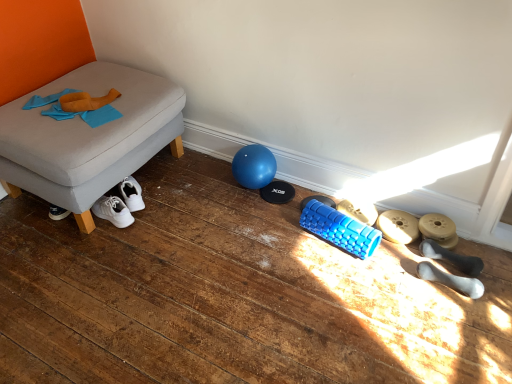
Question: From the image's perspective, does white rubber dumbbell at lower right, which ranks as the first footwear in front-to-back order, appear higher than gray fabric ottoman at left?

Choices:
 (A) no
 (B) yes

Answer: (A)

Question: Is white rubber dumbbell at lower right, placed as the 5th footwear when sorted from back to front, in contact with gray fabric ottoman at left?

Choices:
 (A) yes
 (B) no

Answer: (B)

Question: From the image's perspective, is white rubber dumbbell at lower right, placed as the 5th footwear when sorted from back to front, located beneath gray fabric ottoman at left?

Choices:
 (A) no
 (B) yes

Answer: (B)

Question: Considering the relative sizes of white rubber dumbbell at lower right, placed as the 5th footwear when sorted from back to front, and gray fabric ottoman at left in the image provided, is white rubber dumbbell at lower right, placed as the 5th footwear when sorted from back to front, shorter than gray fabric ottoman at left?

Choices:
 (A) yes
 (B) no

Answer: (A)

Question: Is white rubber dumbbell at lower right, which ranks as the first footwear in front-to-back order, in front of gray fabric ottoman at left?

Choices:
 (A) yes
 (B) no

Answer: (A)

Question: Is white rubber dumbbell at lower right, placed as the 5th footwear when sorted from back to front, further to the viewer compared to gray fabric ottoman at left?

Choices:
 (A) no
 (B) yes

Answer: (A)

Question: Can you confirm if matte gray dumbbell at lower right, the 2th footwear positioned from the back, is positioned to the right of matte gold dumbbell at lower right, positioned as the 3th footwear in back-to-front order?

Choices:
 (A) yes
 (B) no

Answer: (B)

Question: Is matte gray dumbbell at lower right, the 2th footwear positioned from the back, looking in the opposite direction of matte gold dumbbell at lower right, acting as the third footwear starting from the front?

Choices:
 (A) yes
 (B) no

Answer: (B)

Question: Are matte gray dumbbell at lower right, the 2th footwear positioned from the back, and matte gold dumbbell at lower right, acting as the third footwear starting from the front, beside each other?

Choices:
 (A) no
 (B) yes

Answer: (B)

Question: Is matte gray dumbbell at lower right, which appears as the 4th footwear when viewed from the front, closer to camera compared to matte gold dumbbell at lower right, acting as the third footwear starting from the front?

Choices:
 (A) no
 (B) yes

Answer: (A)

Question: Is matte gray dumbbell at lower right, the 2th footwear positioned from the back, not near matte gold dumbbell at lower right, positioned as the 3th footwear in back-to-front order?

Choices:
 (A) yes
 (B) no

Answer: (B)

Question: Is matte gray dumbbell at lower right, the 2th footwear positioned from the back, to the left of matte gold dumbbell at lower right, acting as the third footwear starting from the front, from the viewer's perspective?

Choices:
 (A) no
 (B) yes

Answer: (B)

Question: Is matte gray dumbbell at lower right, the 2th footwear positioned from the back, completely or partially outside of white rubber dumbbell at lower right, placed as the 5th footwear when sorted from back to front?

Choices:
 (A) yes
 (B) no

Answer: (A)